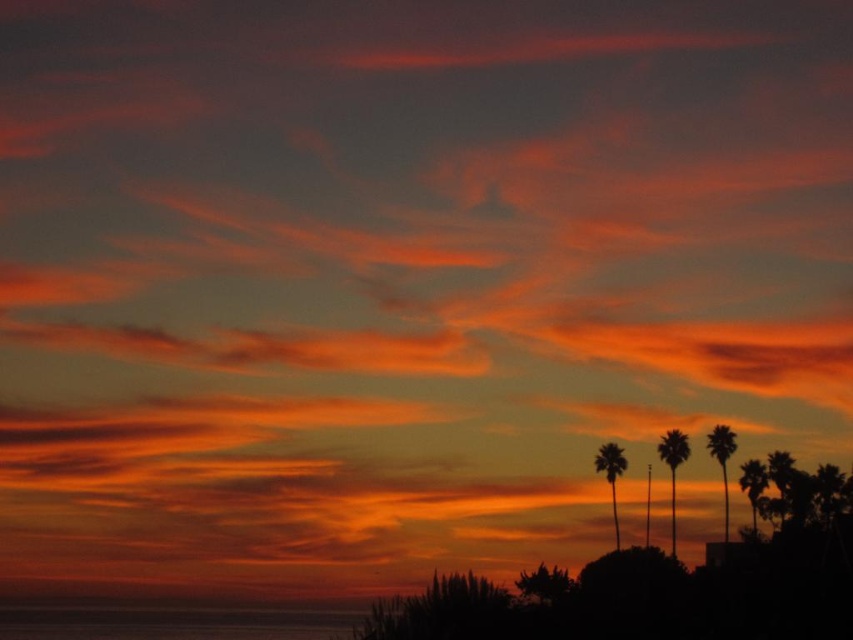
Question: Which of the following is the farthest from the observer?

Choices:
 (A) (613, 496)
 (B) (723, 452)

Answer: (A)

Question: Which point is closer to the camera taking this photo?

Choices:
 (A) (310, 637)
 (B) (724, 480)

Answer: (B)

Question: Is silhouette palm at right wider than silhouette palm tree at lower right?

Choices:
 (A) no
 (B) yes

Answer: (B)

Question: Is silky orange palm tree at right to the right of silky brown palm tree at right from the viewer's perspective?

Choices:
 (A) no
 (B) yes

Answer: (A)

Question: Which point is farther from the camera taking this photo?

Choices:
 (A) (598, 465)
 (B) (763, 468)
 (C) (675, 493)
 (D) (775, 506)

Answer: (C)

Question: Is smooth water at lower center above silky brown palm tree at center?

Choices:
 (A) yes
 (B) no

Answer: (B)